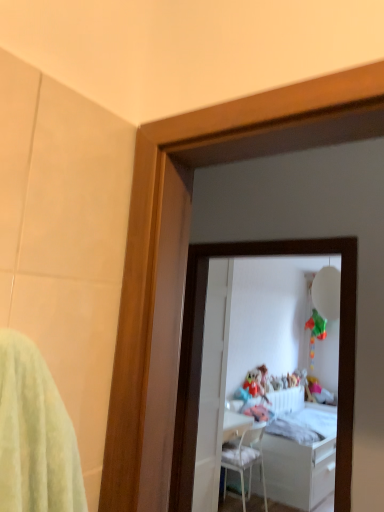
Measure the distance between white glossy mirror at center and camera.

12.32 feet.

What is the approximate width of white glossy door at center?

3.90 inches.

Where is `white glossy door at center`? The width and height of the screenshot is (384, 512). white glossy door at center is located at coordinates (213, 385).

Locate an element on the screen. Image resolution: width=384 pixels, height=512 pixels. white plastic chair at center is located at coordinates (245, 460).

This screenshot has height=512, width=384. What are the coordinates of `white glossy mirror at center` in the screenshot? It's located at (246, 344).

Which is behind, white plastic chair at center or white glossy mirror at center?

white plastic chair at center is further away from the camera.

Is white glossy mirror at center inside white plastic chair at center?

No.

From the image's perspective, is white plastic chair at center below white glossy mirror at center?

Yes, from the image's perspective, white plastic chair at center is below white glossy mirror at center.

Can you tell me how much white plastic chair at center and white glossy mirror at center differ in facing direction?

92.6 degrees.

Which is less distant, (x=214, y=400) or (x=234, y=475)?

The point (x=214, y=400) is in front.

From the image's perspective, does white glossy door at center appear higher than white glossy bed at center?

Yes, from the image's perspective, white glossy door at center is on top of white glossy bed at center.

You are a GUI agent. You are given a task and a screenshot of the screen. Output one action in this format:
    pyautogui.click(x=<x>, y=<y>)
    Task: Click on the bed lying behind the white glossy door at center
    The height and width of the screenshot is (512, 384).
    Given the screenshot: What is the action you would take?
    pyautogui.click(x=302, y=458)

Looking at this image, from a real-world perspective, which object stands above the other?

In real-world perspective, white glossy door at center is above.

Considering the relative positions of white glossy bed at center and white glossy mirror at center in the image provided, is white glossy bed at center in front of white glossy mirror at center?

That is False.

Identify the location of mirror on the left of white glossy bed at center. (246, 344).

Are white glossy bed at center and white glossy mirror at center beside each other?

No, white glossy bed at center is not making contact with white glossy mirror at center.

Does white glossy door at center turn towards white glossy mirror at center?

No, white glossy door at center is not turned towards white glossy mirror at center.

Considering the positions of points (221, 438) and (237, 325), is point (221, 438) farther from camera compared to point (237, 325)?

No.

In the scene shown: Can you confirm if white glossy door at center is bigger than white glossy mirror at center?

Actually, white glossy door at center might be smaller than white glossy mirror at center.

Is white glossy door at center to the left or to the right of white glossy mirror at center in the image?

In the image, white glossy door at center appears on the left side of white glossy mirror at center.

Which of these two, white glossy mirror at center or white glossy door at center, stands shorter?

Standing shorter between the two is white glossy mirror at center.

How different are the orientations of white glossy mirror at center and white glossy door at center in degrees?

The angle between the facing direction of white glossy mirror at center and the facing direction of white glossy door at center is 89.7 degrees.

Based on the photo, is white glossy mirror at center not within white glossy door at center?

Yes, white glossy mirror at center is not within white glossy door at center.

Is there a large distance between white glossy mirror at center and white glossy door at center?

Yes, white glossy mirror at center and white glossy door at center are quite far apart.

Is white glossy bed at center placed right next to white glossy door at center?

There is a gap between white glossy bed at center and white glossy door at center.

Who is shorter, white glossy bed at center or white glossy door at center?

With less height is white glossy bed at center.

Is the position of white glossy bed at center less distant than that of white glossy door at center?

No, the depth of white glossy bed at center is greater than that of white glossy door at center.

Is white glossy door at center surrounded by white glossy bed at center?

That's incorrect, white glossy door at center is not inside white glossy bed at center.

Is white glossy door at center smaller than white plastic chair at center?

Correct, white glossy door at center occupies less space than white plastic chair at center.

Does white glossy door at center have a lesser width compared to white plastic chair at center?

Yes, white glossy door at center is thinner than white plastic chair at center.

Do you think white glossy door at center is within white plastic chair at center, or outside of it?

white glossy door at center is not inside white plastic chair at center, it's outside.

Would you consider white glossy door at center to be distant from white plastic chair at center?

No, white glossy door at center is in close proximity to white plastic chair at center.

Identify the location of chair that appears below the white glossy mirror at center (from the image's perspective). click(x=245, y=460).

This screenshot has width=384, height=512. In order to click on door on the left side of white glossy bed at center in this screenshot , I will do `click(213, 385)`.

Looking at the image, which one is located further to white glossy mirror at center, white plastic chair at center or white glossy door at center?

white glossy door at center.

In the scene shown: Based on their spatial positions, is white plastic chair at center or white glossy mirror at center further from white glossy door at center?

white glossy mirror at center is further to white glossy door at center.

Considering their positions, is white glossy bed at center positioned closer to white glossy door at center than white glossy mirror at center?

The object closer to white glossy door at center is white glossy mirror at center.

Estimate the real-world distances between objects in this image. Which object is closer to white glossy mirror at center, white plastic chair at center or white glossy bed at center?

Based on the image, white glossy bed at center appears to be nearer to white glossy mirror at center.

Considering their positions, is white glossy mirror at center positioned closer to white plastic chair at center than white glossy bed at center?

Among the two, white glossy bed at center is located nearer to white plastic chair at center.

Based on their spatial positions, is white glossy door at center or white glossy bed at center closer to white plastic chair at center?

white glossy bed at center.

Based on their spatial positions, is white glossy bed at center or white glossy mirror at center further from white plastic chair at center?

white glossy mirror at center.

Which object lies nearer to the anchor point white glossy mirror at center, white glossy bed at center or white plastic chair at center?

white glossy bed at center.

At what (x,y) coordinates should I click in order to perform the action: click on chair between white glossy door at center and white glossy bed at center from left to right. Please return your answer as a coordinate pair (x, y). The image size is (384, 512). Looking at the image, I should click on (245, 460).

I want to click on door positioned between white glossy mirror at center and white plastic chair at center from near to far, so point(213,385).

The width and height of the screenshot is (384, 512). What are the coordinates of `door between white glossy mirror at center and white glossy bed at center along the z-axis` in the screenshot? It's located at (213, 385).

At what (x,y) coordinates should I click in order to perform the action: click on chair between white glossy mirror at center and white glossy bed at center in the front-back direction. Please return your answer as a coordinate pair (x, y). Looking at the image, I should click on (245, 460).